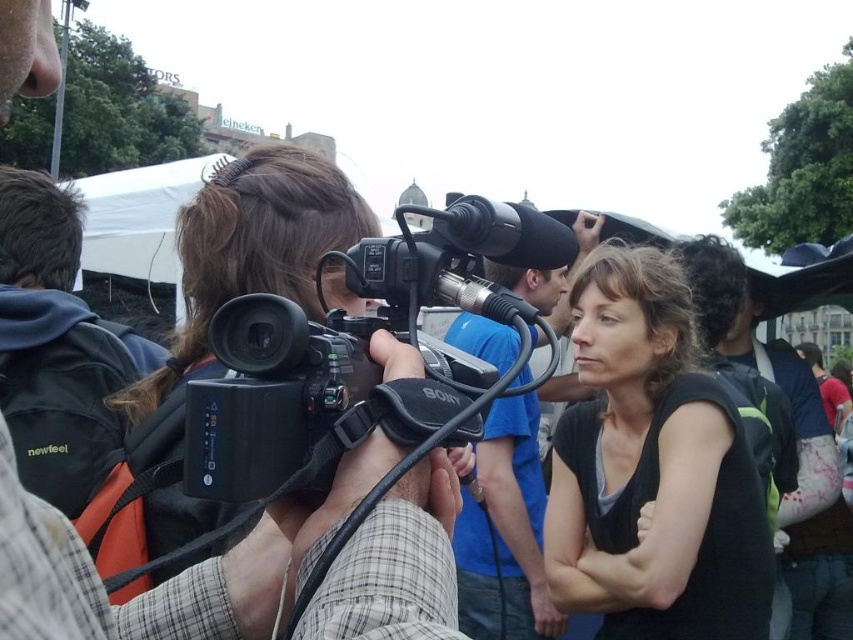
Can you confirm if black matte shirt at center is positioned to the right of black fabric backpack at left?

Yes, black matte shirt at center is to the right of black fabric backpack at left.

Between black matte shirt at center and black fabric backpack at left, which one has more height?

Standing taller between the two is black matte shirt at center.

The width and height of the screenshot is (853, 640). Describe the element at coordinates (653, 468) in the screenshot. I see `black matte shirt at center` at that location.

This screenshot has width=853, height=640. What are the coordinates of `black matte shirt at center` in the screenshot? It's located at click(x=653, y=468).

Who is lower down, matte black camera at center or black fabric backpack at left?

matte black camera at center

Does matte black camera at center come in front of black fabric backpack at left?

Yes, matte black camera at center is closer to the viewer.

Is point (268, 616) farther from camera compared to point (42, 266)?

No.

Where is `matte black camera at center`? matte black camera at center is located at coordinates (167, 579).

Consider the image. Does black plastic camera at center have a smaller size compared to blue fabric shirt at center?

Correct, black plastic camera at center occupies less space than blue fabric shirt at center.

Is point (248, 326) more distant than point (549, 628)?

No, it is in front of (549, 628).

Image resolution: width=853 pixels, height=640 pixels. What are the coordinates of `black plastic camera at center` in the screenshot? It's located at [x=305, y=400].